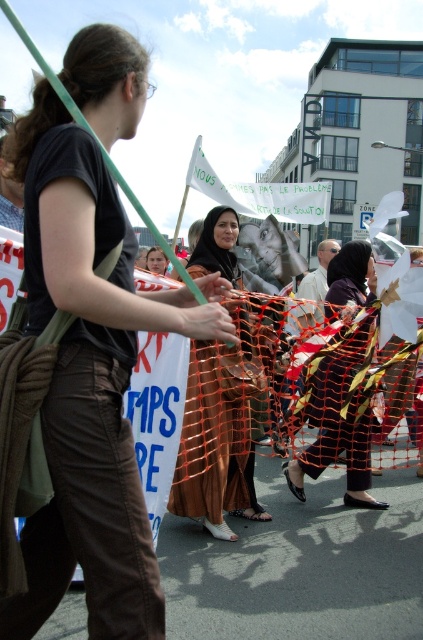
Does brown cotton pants at left have a larger size compared to black fabric hijab at center?

Yes.

Who is positioned more to the right, brown cotton pants at left or black fabric hijab at center?

black fabric hijab at center

Locate an element on the screen. The width and height of the screenshot is (423, 640). brown cotton pants at left is located at coordinates (88, 384).

Between brown cotton pants at left and brown satin dress at center, which one appears on the right side from the viewer's perspective?

Positioned to the right is brown satin dress at center.

Does brown cotton pants at left appear under brown satin dress at center?

Actually, brown cotton pants at left is above brown satin dress at center.

Describe the element at coordinates (88, 384) in the screenshot. This screenshot has width=423, height=640. I see `brown cotton pants at left` at that location.

Where is `brown cotton pants at left`? brown cotton pants at left is located at coordinates (88, 384).

Can you confirm if brown satin dress at center is thinner than black fabric hijab at center?

Yes.

Find the location of a particular element. brown satin dress at center is located at coordinates (217, 435).

Who is more distant from viewer, (214, 380) or (315, 392)?

Point (315, 392)

Identify the location of brown satin dress at center. (217, 435).